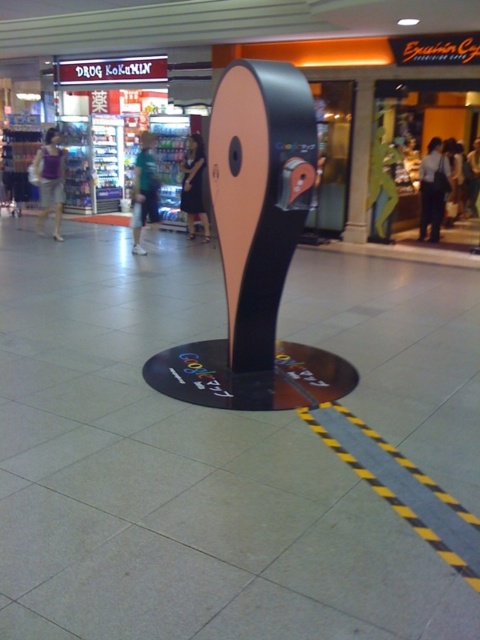
Question: Which point is closer to the camera?

Choices:
 (A) (240, 230)
 (B) (279, 0)
 (C) (44, 180)

Answer: (A)

Question: Is matte black display stand at center to the left of green fabric bag at center from the viewer's perspective?

Choices:
 (A) no
 (B) yes

Answer: (A)

Question: Can you confirm if matte purple tank top at left is positioned to the right of green fabric shirt at center?

Choices:
 (A) no
 (B) yes

Answer: (A)

Question: Among these points, which one is nearest to the camera?

Choices:
 (A) (315, 3)
 (B) (223, 170)
 (C) (57, 234)

Answer: (B)

Question: In this image, where is matte black shirt at center located relative to green fabric bag at center?

Choices:
 (A) below
 (B) above

Answer: (B)

Question: Considering the real-world distances, which object is farthest from the matte purple tank top at left?

Choices:
 (A) matte black shirt at center
 (B) green fabric shirt at center

Answer: (A)